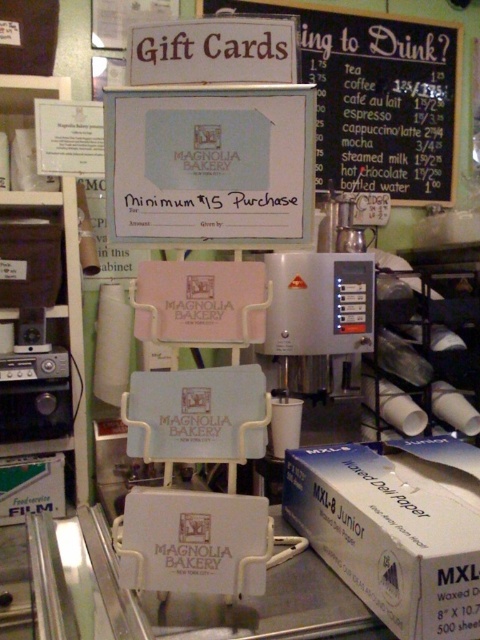
Question: Which of the following is the farthest from the observer?

Choices:
 (A) (317, 67)
 (B) (283, 360)

Answer: (A)

Question: Is waxed paper at lower right positioned in front of black chalkboard at upper center?

Choices:
 (A) yes
 (B) no

Answer: (A)

Question: Is black chalkboard at upper center wider than satin silver machine at center?

Choices:
 (A) yes
 (B) no

Answer: (A)

Question: Which is nearer to the black chalkboard at upper center?

Choices:
 (A) waxed paper at lower right
 (B) satin silver machine at center

Answer: (B)

Question: Which object is closer to the camera taking this photo?

Choices:
 (A) waxed paper at lower right
 (B) satin silver machine at center
 (C) black chalkboard at upper center

Answer: (A)

Question: Is waxed paper at lower right positioned at the back of black chalkboard at upper center?

Choices:
 (A) yes
 (B) no

Answer: (B)